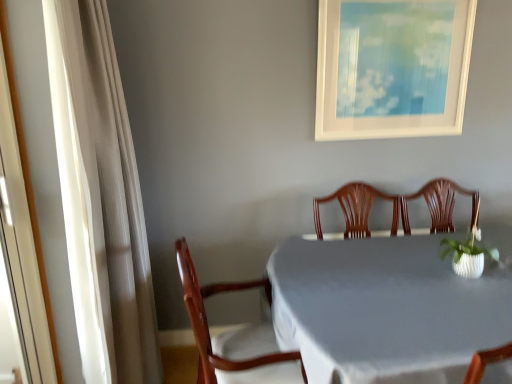
Question: Does wooden chair at center have a larger size compared to white cloth-covered table at center?

Choices:
 (A) no
 (B) yes

Answer: (A)

Question: Could you tell me if wooden chair at center is turned towards white cloth-covered table at center?

Choices:
 (A) yes
 (B) no

Answer: (A)

Question: Is wooden chair at center taller than white cloth-covered table at center?

Choices:
 (A) yes
 (B) no

Answer: (A)

Question: Is the position of wooden chair at center more distant than that of white cloth-covered table at center?

Choices:
 (A) no
 (B) yes

Answer: (B)

Question: Is white cloth-covered table at center completely or partially inside wooden chair at center?

Choices:
 (A) no
 (B) yes

Answer: (A)

Question: Looking at their shapes, would you say white glossy screen door at left is wider or thinner than wooden chair at center?

Choices:
 (A) thin
 (B) wide

Answer: (A)

Question: Relative to wooden chair at center, is white glossy screen door at left in front or behind?

Choices:
 (A) behind
 (B) front

Answer: (B)

Question: From a real-world perspective, is white glossy screen door at left above or below wooden chair at center?

Choices:
 (A) below
 (B) above

Answer: (B)

Question: Is point (41, 286) positioned closer to the camera than point (202, 357)?

Choices:
 (A) farther
 (B) closer

Answer: (A)

Question: From a real-world perspective, is white sheer curtain at left physically located above or below white cloth-covered table at center?

Choices:
 (A) below
 (B) above

Answer: (B)

Question: Which is correct: white sheer curtain at left is inside white cloth-covered table at center, or outside of it?

Choices:
 (A) inside
 (B) outside

Answer: (B)

Question: In the image, is white sheer curtain at left positioned in front of or behind white cloth-covered table at center?

Choices:
 (A) behind
 (B) front

Answer: (A)

Question: Is white sheer curtain at left to the left or to the right of white cloth-covered table at center in the image?

Choices:
 (A) right
 (B) left

Answer: (B)

Question: Looking at the image, does white cloth-covered table at center seem bigger or smaller compared to white textured vase at right?

Choices:
 (A) small
 (B) big

Answer: (B)

Question: From the image's perspective, is white cloth-covered table at center above or below white textured vase at right?

Choices:
 (A) above
 (B) below

Answer: (B)